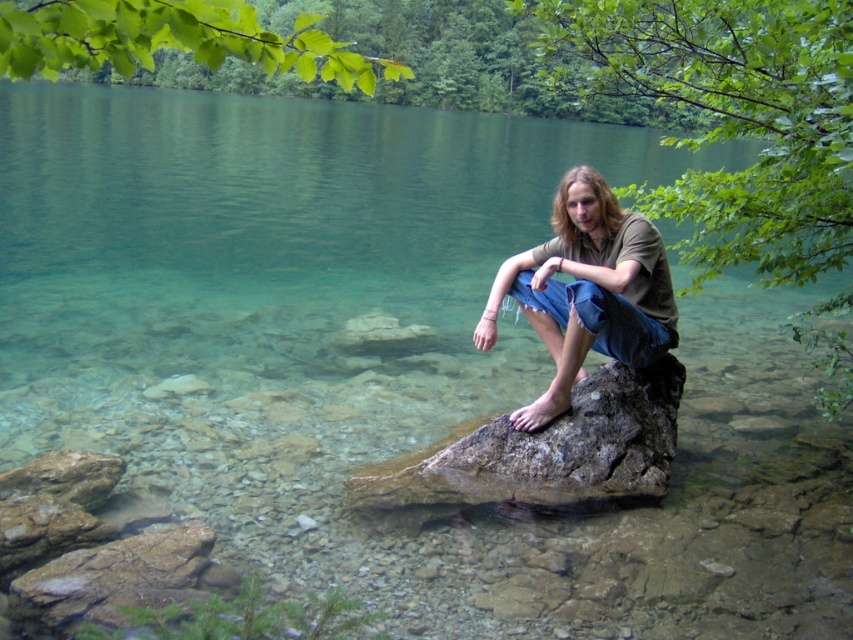
You are a photographer aiming to capture the brown cotton shirt at center and the brown rough rock at lower left in the same frame. Based on their positions, which object is closer to the camera?

The brown cotton shirt at center is closer to the camera because it is positioned above the brown rough rock at lower left, indicating a closer proximity in the visual plane.

You are an artist trying to sketch the scene. You notice the brown cotton shirt at center and the brown rough rock at lower left. Which object should you draw first if you want to capture the larger width in your sketch?

The brown cotton shirt at center should be drawn first because its width is larger than the brown rough rock at lower left, ensuring the larger object is captured accurately in the sketch.

Based on the scene described, which object is positioned higher in the image, the brown cotton shirt at center or the brown rough rock at lower left?

The brown cotton shirt at center is much taller than the brown rough rock at lower left, so the brown cotton shirt at center is positioned higher in the image.